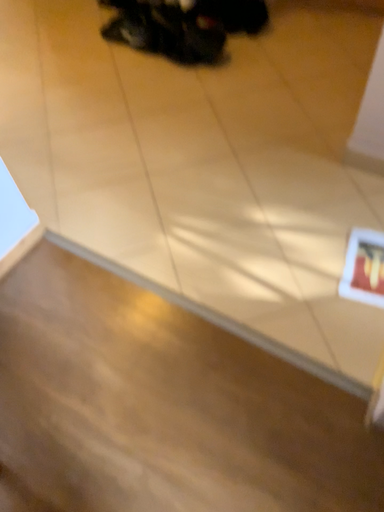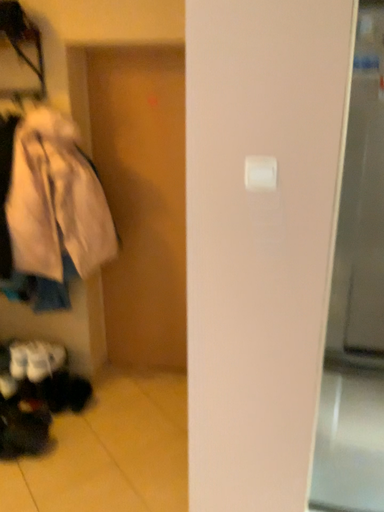
Question: How did the camera likely rotate when shooting the video?

Choices:
 (A) rotated downward
 (B) rotated upward

Answer: (B)